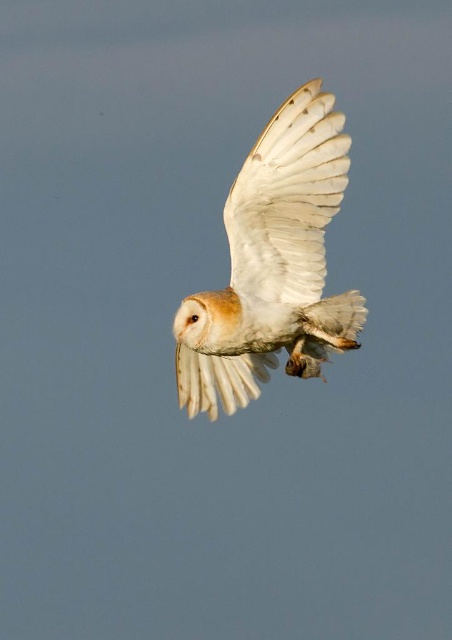
You are an ornithologist observing the barn owl in flight. You notice the white feathered owl at center and the white feathered wing at center. Which object is closer to you, the observer?

The white feathered owl at center is closer to you than the white feathered wing at center, so the owl is the closer object.

You are an ornithologist observing the white feathered owl at center and the white feathered wing at center in the image. Which object is positioned to the left?

The white feathered wing at center is positioned to the left of the white feathered owl at center.